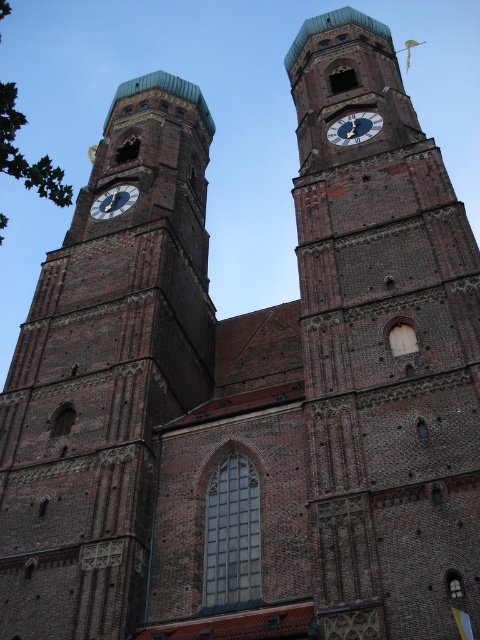
Consider the image. You are an architect planning to install a new lighting system on the brown brick clock tower at left and the gold metallic clock at left. Which structure requires taller lighting poles to accommodate its height?

The brown brick clock tower at left requires taller lighting poles because it is much taller than the gold metallic clock at left.

You are standing in front of the church and see the brown brick clock tower at left and the gold metallic clock at left. Which object is positioned more to the left side?

The gold metallic clock at left is positioned more to the left side because the brown brick clock tower at left is to the right of it.